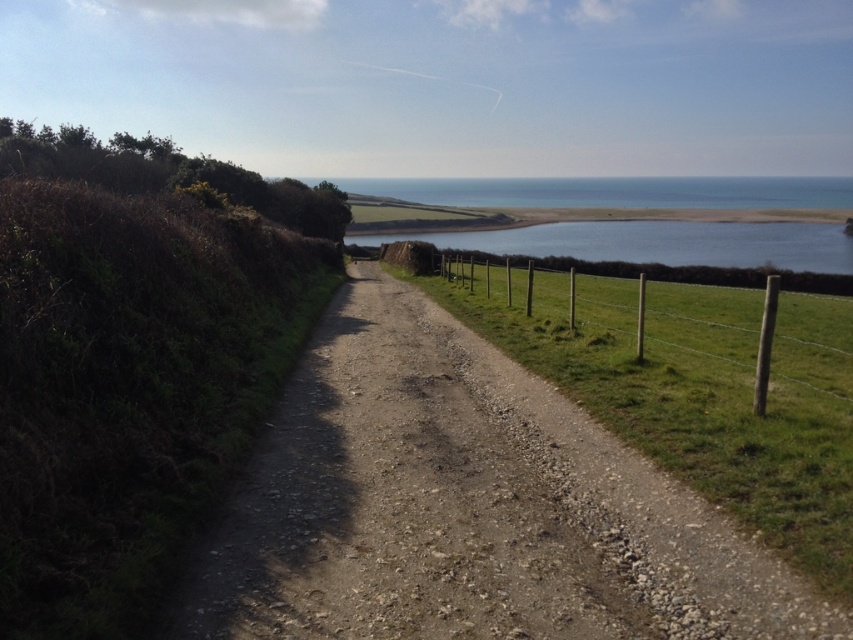
You are a gardener standing on the dirt path and want to water the green grassy at right and the wooden post fence at right. Which object should you water first if you want to start from the closest one to you?

The green grassy at right is positioned on the left side of wooden post fence at right, so it is closer to you. Therefore, you should water the green grassy at right first.

You are a gardener planning to plant flowers along the path. You have two areas to consider for planting the flowers. The first area is the green grassy at right, and the second area is the blue water at center. Which area is shorter in height and thus more suitable for planting flowers?

The green grassy at right has a lesser height compared to blue water at center, so it is more suitable for planting flowers.